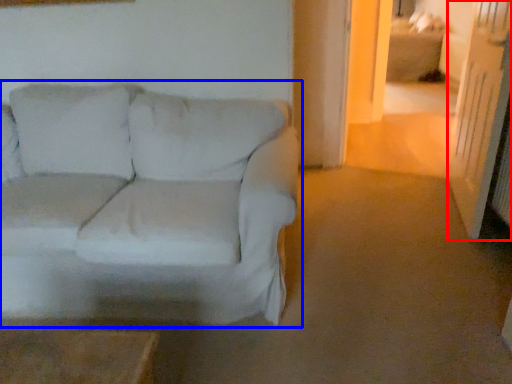
Question: Which object is further to the camera taking this photo, glass door (highlighted by a red box) or studio couch (highlighted by a blue box)?

Choices:
 (A) glass door
 (B) studio couch

Answer: (A)